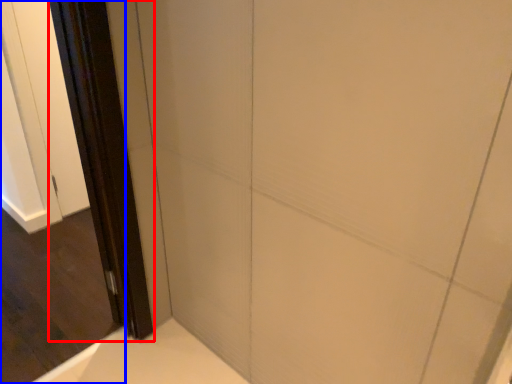
Question: Which of the following is the farthest to the observer, screen door (highlighted by a red box) or screen door (highlighted by a blue box)?

Choices:
 (A) screen door
 (B) screen door

Answer: (A)